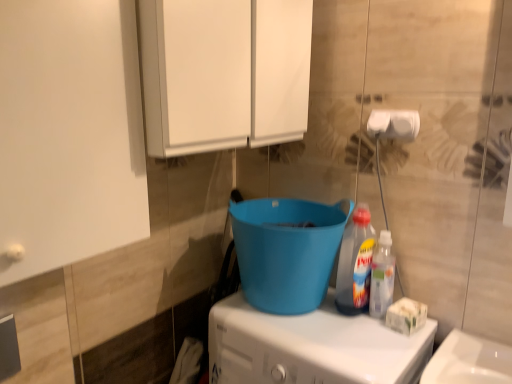
What do you see at coordinates (224, 73) in the screenshot? The width and height of the screenshot is (512, 384). I see `white matte cabinet at upper center` at bounding box center [224, 73].

Locate an element on the screen. Image resolution: width=512 pixels, height=384 pixels. white matte toilet paper at upper right is located at coordinates point(394,124).

What is the approximate height of white matte toilet paper at upper right?

It is 3.29 inches.

Locate an element on the screen. white matte cabinet at upper center is located at coordinates (224, 73).

Which is more to the right, blue plastic bucket at center or translucent plastic bottle at center-right, which ranks as the 1th bottle in left-to-right order?

From the viewer's perspective, translucent plastic bottle at center-right, which ranks as the 1th bottle in left-to-right order, appears more on the right side.

Is blue plastic bucket at center touching translucent plastic bottle at center-right, which ranks as the 1th bottle in left-to-right order?

They are not placed beside each other.

Considering their positions, is blue plastic bucket at center located in front of or behind translucent plastic bottle at center-right, which ranks as the 1th bottle in left-to-right order?

In the image, blue plastic bucket at center appears in front of translucent plastic bottle at center-right, which ranks as the 1th bottle in left-to-right order.

From a real-world perspective, is blue plastic bucket at center on top of translucent plastic bottle at center-right, the 2th bottle viewed from the right?

Yes, from a real-world perspective, blue plastic bucket at center is on top of translucent plastic bottle at center-right, the 2th bottle viewed from the right.

Is translucent plastic bottle at center-right, the 2th bottle viewed from the right, bigger than blue plastic bucket at center?

Actually, translucent plastic bottle at center-right, the 2th bottle viewed from the right, might be smaller than blue plastic bucket at center.

Is translucent plastic bottle at center-right, which ranks as the 1th bottle in left-to-right order, facing towards blue plastic bucket at center?

No, translucent plastic bottle at center-right, which ranks as the 1th bottle in left-to-right order, is not oriented towards blue plastic bucket at center.

Is translucent plastic bottle at center-right, the 2th bottle viewed from the right, wider or thinner than blue plastic bucket at center?

Considering their sizes, translucent plastic bottle at center-right, the 2th bottle viewed from the right, looks slimmer than blue plastic bucket at center.

From the image's perspective, is white matte toilet paper at upper right beneath translucent plastic bottle at center-right, which ranks as the 1th bottle in left-to-right order?

Actually, white matte toilet paper at upper right appears above translucent plastic bottle at center-right, which ranks as the 1th bottle in left-to-right order, in the image.

From a real-world perspective, which object rests below the other?

translucent plastic bottle at center-right, the 2th bottle viewed from the right, from a real-world perspective.

In the scene shown: Considering the positions of objects white matte toilet paper at upper right and translucent plastic bottle at center-right, the 2th bottle viewed from the right, in the image provided, who is behind, white matte toilet paper at upper right or translucent plastic bottle at center-right, the 2th bottle viewed from the right,?

translucent plastic bottle at center-right, the 2th bottle viewed from the right, is further from the camera.

Which is more to the right, white matte toilet paper at upper right or translucent plastic bottle at center-right, which ranks as the 1th bottle in left-to-right order?

From the viewer's perspective, white matte toilet paper at upper right appears more on the right side.

From the image's perspective, between translucent plastic bottle at right, which is the first bottle from right to left, and blue plastic bucket at center, which one is located above?

blue plastic bucket at center, from the image's perspective.

Between point (390, 242) and point (237, 238), which one is positioned behind?

The point (390, 242) is more distant.

Is translucent plastic bottle at right, the second bottle positioned from the left, positioned before blue plastic bucket at center?

No, translucent plastic bottle at right, the second bottle positioned from the left, is further to the viewer.

Does translucent plastic bottle at right, the second bottle positioned from the left, have a larger size compared to blue plastic bucket at center?

Incorrect, translucent plastic bottle at right, the second bottle positioned from the left, is not larger than blue plastic bucket at center.

Based on the photo, would you say white matte toilet paper at upper right is to the left or to the right of blue plastic bucket at center in the picture?

white matte toilet paper at upper right is positioned on blue plastic bucket at center's right side.

Can you tell me how much white matte toilet paper at upper right and blue plastic bucket at center differ in facing direction?

The facing directions of white matte toilet paper at upper right and blue plastic bucket at center are 0.785 degrees apart.

From the image's perspective, is white matte toilet paper at upper right on blue plastic bucket at center?

Indeed, from the image's perspective, white matte toilet paper at upper right is shown above blue plastic bucket at center.

Is white matte toilet paper at upper right oriented towards blue plastic bucket at center?

No, white matte toilet paper at upper right is not oriented towards blue plastic bucket at center.

Is white plastic washing machine at lower center beside translucent plastic bottle at right, the second bottle positioned from the left?

white plastic washing machine at lower center is not next to translucent plastic bottle at right, the second bottle positioned from the left, and they're not touching.

Is white plastic washing machine at lower center taller or shorter than translucent plastic bottle at right, which is the first bottle from right to left?

In the image, white plastic washing machine at lower center appears to be taller than translucent plastic bottle at right, which is the first bottle from right to left.

From a real-world perspective, is white plastic washing machine at lower center over translucent plastic bottle at right, which is the first bottle from right to left?

No.

Considering the sizes of white plastic washing machine at lower center and translucent plastic bottle at right, which is the first bottle from right to left, in the image, is white plastic washing machine at lower center wider or thinner than translucent plastic bottle at right, which is the first bottle from right to left,?

Clearly, white plastic washing machine at lower center has more width compared to translucent plastic bottle at right, which is the first bottle from right to left.

Is white matte cabinet at upper center in contact with translucent plastic bottle at center-right, the 2th bottle viewed from the right?

No.

From the image's perspective, is white matte cabinet at upper center under translucent plastic bottle at center-right, the 2th bottle viewed from the right?

No, from the image's perspective, white matte cabinet at upper center is not below translucent plastic bottle at center-right, the 2th bottle viewed from the right.

Is white matte cabinet at upper center not inside translucent plastic bottle at center-right, which ranks as the 1th bottle in left-to-right order?

Yes, white matte cabinet at upper center is not within translucent plastic bottle at center-right, which ranks as the 1th bottle in left-to-right order.

Considering the sizes of objects white matte cabinet at upper center and translucent plastic bottle at center-right, the 2th bottle viewed from the right, in the image provided, who is wider, white matte cabinet at upper center or translucent plastic bottle at center-right, the 2th bottle viewed from the right,?

With larger width is white matte cabinet at upper center.

From the image's perspective, which bottle is the 1st one below the blue plastic bucket at center? Please provide its 2D coordinates.

[(355, 264)]

Locate an element on the screen. The image size is (512, 384). the 1st bottle located beneath the blue plastic bucket at center (from a real-world perspective) is located at coordinates (355, 264).

From the image, which object appears to be nearer to blue plastic bucket at center, white matte toilet paper at upper right or white plastic washing machine at lower center?

Based on the image, white plastic washing machine at lower center appears to be nearer to blue plastic bucket at center.

From the image, which object appears to be nearer to white matte toilet paper at upper right, white plastic washing machine at lower center or translucent plastic bottle at right, which is the first bottle from right to left?

translucent plastic bottle at right, which is the first bottle from right to left, is closer to white matte toilet paper at upper right.

Considering their positions, is white plastic washing machine at lower center positioned closer to translucent plastic bottle at right, which is the first bottle from right to left, than white matte cabinet at upper center?

white plastic washing machine at lower center lies closer to translucent plastic bottle at right, which is the first bottle from right to left, than the other object.

From the image, which object appears to be farther from translucent plastic bottle at center-right, which ranks as the 1th bottle in left-to-right order, translucent plastic bottle at right, the second bottle positioned from the left, or white matte cabinet at upper center?

white matte cabinet at upper center lies further to translucent plastic bottle at center-right, which ranks as the 1th bottle in left-to-right order, than the other object.

Which object lies nearer to the anchor point white plastic washing machine at lower center, translucent plastic bottle at center-right, the 2th bottle viewed from the right, or white matte cabinet at upper center?

translucent plastic bottle at center-right, the 2th bottle viewed from the right, is closer to white plastic washing machine at lower center.

Looking at the image, which one is located further to white plastic washing machine at lower center, white matte cabinet at upper center or white matte toilet paper at upper right?

Based on the image, white matte cabinet at upper center appears to be further to white plastic washing machine at lower center.

When comparing their distances from translucent plastic bottle at right, which is the first bottle from right to left, does white matte toilet paper at upper right or white matte cabinet at upper center seem further?

white matte cabinet at upper center is further to translucent plastic bottle at right, which is the first bottle from right to left.

Considering their positions, is white matte cabinet at upper center positioned further to white plastic washing machine at lower center than blue plastic bucket at center?

white matte cabinet at upper center is further to white plastic washing machine at lower center.

You are a GUI agent. You are given a task and a screenshot of the screen. Output one action in this format:
    pyautogui.click(x=<x>, y=<y>)
    Task: Click on the toilet paper that lies between white matte cabinet at upper center and translucent plastic bottle at center-right, the 2th bottle viewed from the right, from top to bottom
    Image resolution: width=512 pixels, height=384 pixels.
    Given the screenshot: What is the action you would take?
    pyautogui.click(x=394, y=124)

At what (x,y) coordinates should I click in order to perform the action: click on basin between white matte cabinet at upper center and translucent plastic bottle at right, the second bottle positioned from the left, in the vertical direction. Please return your answer as a coordinate pair (x, y). This screenshot has height=384, width=512. Looking at the image, I should click on (287, 251).

Find the location of a particular element. The width and height of the screenshot is (512, 384). basin between white matte cabinet at upper center and white plastic washing machine at lower center from top to bottom is located at coordinates (287, 251).

Find the location of a particular element. This screenshot has width=512, height=384. basin between white matte toilet paper at upper right and translucent plastic bottle at right, which is the first bottle from right to left, vertically is located at coordinates (287, 251).